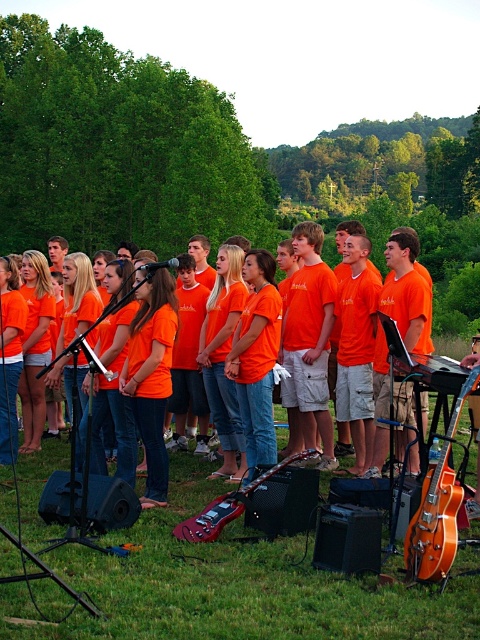
Question: Does orange cotton shirt at center have a smaller size compared to glossy wood guitar at right?

Choices:
 (A) yes
 (B) no

Answer: (B)

Question: Which point is farther to the camera?

Choices:
 (A) (368, 390)
 (B) (279, 468)
 (C) (431, 531)

Answer: (A)

Question: Does orange cotton shirt at center appear over glossy red electric guitar at lower center?

Choices:
 (A) yes
 (B) no

Answer: (A)

Question: Can you confirm if orange wood electric guitar at lower right is bigger than glossy red electric guitar at lower center?

Choices:
 (A) no
 (B) yes

Answer: (A)

Question: Which point is farther from the camera taking this photo?

Choices:
 (A) (279, 330)
 (B) (192, 524)
 (C) (416, 371)
 (D) (437, 516)

Answer: (A)

Question: Which object appears closest to the camera in this image?

Choices:
 (A) glossy red electric guitar at lower center
 (B) orange wood electric guitar at lower right
 (C) orange cotton shirt at center
 (D) glossy wood guitar at right

Answer: (B)